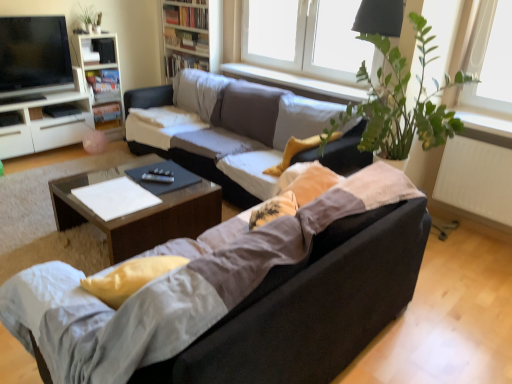
This screenshot has width=512, height=384. I want to click on vacant space in white plastic window at upper center (from a real-world perspective), so click(x=292, y=72).